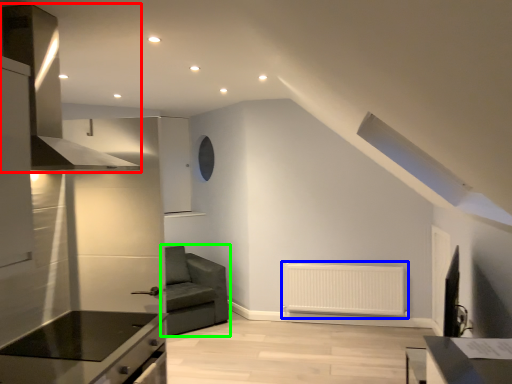
Question: Considering the real-world distances, which object is closest to exhaust hood (highlighted by a red box)? radiator (highlighted by a blue box) or studio couch (highlighted by a green box).

Choices:
 (A) radiator
 (B) studio couch

Answer: (B)